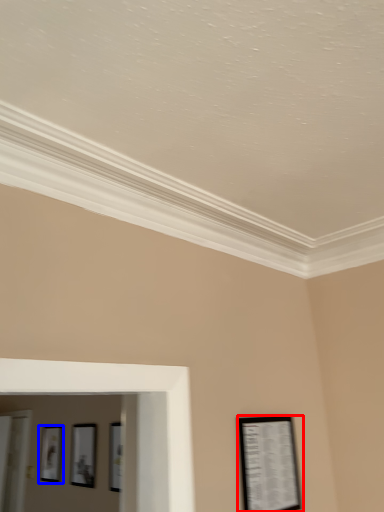
Question: Which of the following is the farthest to the observer, picture frame (highlighted by a red box) or picture frame (highlighted by a blue box)?

Choices:
 (A) picture frame
 (B) picture frame

Answer: (B)